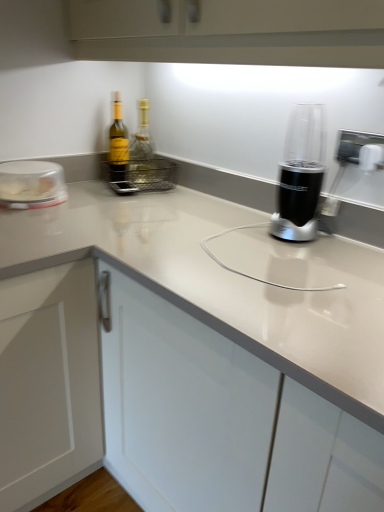
Question: Which direction should I rotate to look at translucent glass bottle at center, the first bottle positioned from the right?

Choices:
 (A) right
 (B) left

Answer: (B)

Question: From the image's perspective, is green glass bottle at upper left, which is the second bottle from right to left, under black plastic blender at center?

Choices:
 (A) no
 (B) yes

Answer: (A)

Question: From a real-world perspective, does green glass bottle at upper left, which is the second bottle from right to left, stand above black plastic blender at center?

Choices:
 (A) no
 (B) yes

Answer: (A)

Question: Does green glass bottle at upper left, acting as the 1th bottle starting from the left, have a smaller size compared to black plastic blender at center?

Choices:
 (A) no
 (B) yes

Answer: (B)

Question: Is green glass bottle at upper left, acting as the 1th bottle starting from the left, placed right next to black plastic blender at center?

Choices:
 (A) yes
 (B) no

Answer: (B)

Question: Is green glass bottle at upper left, which is the second bottle from right to left, oriented away from black plastic blender at center?

Choices:
 (A) no
 (B) yes

Answer: (A)

Question: Does green glass bottle at upper left, acting as the 1th bottle starting from the left, have a greater height compared to black plastic blender at center?

Choices:
 (A) yes
 (B) no

Answer: (A)

Question: Is green glass bottle at upper left, which is the second bottle from right to left, next to translucent glass bottle at center, the first bottle positioned from the right?

Choices:
 (A) yes
 (B) no

Answer: (A)

Question: Considering the relative sizes of green glass bottle at upper left, which is the second bottle from right to left, and translucent glass bottle at center, which appears as the 2th bottle when viewed from the left, in the image provided, is green glass bottle at upper left, which is the second bottle from right to left, thinner than translucent glass bottle at center, which appears as the 2th bottle when viewed from the left,?

Choices:
 (A) yes
 (B) no

Answer: (B)

Question: Does green glass bottle at upper left, which is the second bottle from right to left, have a smaller size compared to translucent glass bottle at center, the first bottle positioned from the right?

Choices:
 (A) no
 (B) yes

Answer: (B)

Question: From a real-world perspective, is green glass bottle at upper left, acting as the 1th bottle starting from the left, physically below translucent glass bottle at center, the first bottle positioned from the right?

Choices:
 (A) yes
 (B) no

Answer: (B)

Question: From the image's perspective, would you say green glass bottle at upper left, acting as the 1th bottle starting from the left, is positioned over translucent glass bottle at center, the first bottle positioned from the right?

Choices:
 (A) no
 (B) yes

Answer: (A)

Question: Could translucent glass bottle at center, which appears as the 2th bottle when viewed from the left, be considered to be inside green glass bottle at upper left, acting as the 1th bottle starting from the left?

Choices:
 (A) no
 (B) yes

Answer: (A)

Question: Is green glass bottle at upper left, which is the second bottle from right to left, next to clear plastic container at left?

Choices:
 (A) no
 (B) yes

Answer: (A)